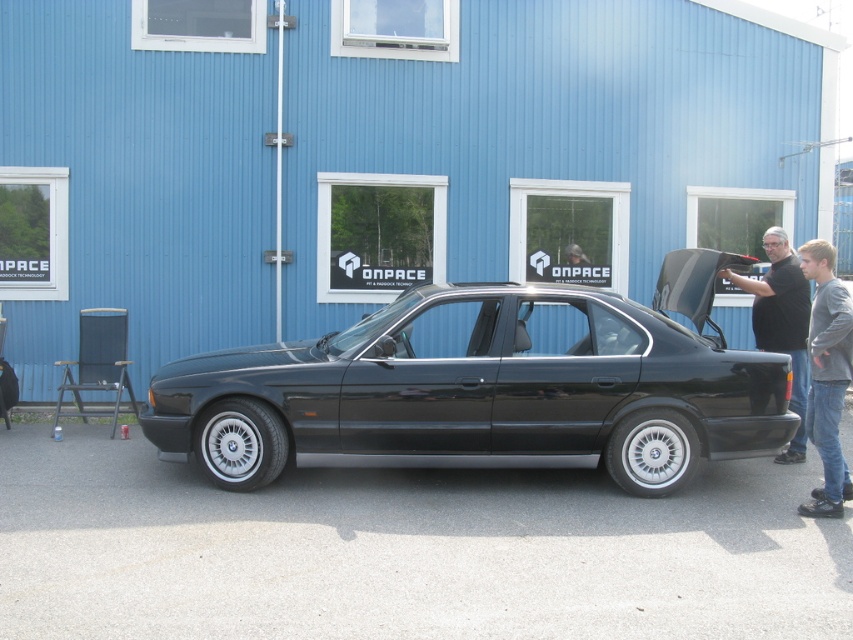
Is point (508, 417) positioned after point (780, 305)?

No, (508, 417) is in front of (780, 305).

Does black metallic car at center have a smaller size compared to black matte shirt at right?

Actually, black metallic car at center might be larger than black matte shirt at right.

Image resolution: width=853 pixels, height=640 pixels. In order to click on black metallic car at center in this screenshot , I will do `click(486, 387)`.

Is gray cotton sweater at lower right smaller than black matte shirt at right?

Correct, gray cotton sweater at lower right occupies less space than black matte shirt at right.

Is point (851, 321) positioned after point (740, 280)?

No, it is not.

At what (x,y) coordinates should I click in order to perform the action: click on gray cotton sweater at lower right. Please return your answer as a coordinate pair (x, y). This screenshot has width=853, height=640. Looking at the image, I should click on (827, 376).

Does point (332, 336) lie behind point (834, 435)?

Yes, point (332, 336) is farther from viewer.

Measure the distance between point (709, 419) and camera.

A distance of 6.88 meters exists between point (709, 419) and camera.

Which is behind, point (160, 429) or point (845, 364)?

The point (160, 429) is more distant.

At what (x,y) coordinates should I click in order to perform the action: click on black metallic car at center. Please return your answer as a coordinate pair (x, y). The image size is (853, 640). Looking at the image, I should click on (486, 387).